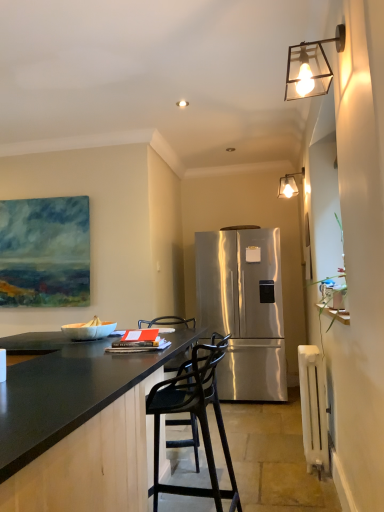
Question: Can you confirm if stainless steel refrigerator at center is taller than white painted radiator at lower right?

Choices:
 (A) yes
 (B) no

Answer: (A)

Question: Can we say stainless steel refrigerator at center lies outside white painted radiator at lower right?

Choices:
 (A) no
 (B) yes

Answer: (B)

Question: Is stainless steel refrigerator at center wider than white painted radiator at lower right?

Choices:
 (A) yes
 (B) no

Answer: (A)

Question: Is white painted radiator at lower right at the back of stainless steel refrigerator at center?

Choices:
 (A) no
 (B) yes

Answer: (A)

Question: From a real-world perspective, is stainless steel refrigerator at center located beneath white painted radiator at lower right?

Choices:
 (A) no
 (B) yes

Answer: (A)

Question: Is stainless steel refrigerator at center surrounding white painted radiator at lower right?

Choices:
 (A) no
 (B) yes

Answer: (A)

Question: From the image's perspective, is metallic glass lampshade at upper right, which ranks as the second lamp in front-to-back order, under black granite countertop at center?

Choices:
 (A) no
 (B) yes

Answer: (A)

Question: Is metallic glass lampshade at upper right, which ranks as the 2th lamp in left-to-right order, surrounding black granite countertop at center?

Choices:
 (A) no
 (B) yes

Answer: (A)

Question: Are metallic glass lampshade at upper right, the 1th lamp from the back, and black granite countertop at center located far from each other?

Choices:
 (A) no
 (B) yes

Answer: (B)

Question: Can we say metallic glass lampshade at upper right, marked as the first lamp in a right-to-left arrangement, lies outside black granite countertop at center?

Choices:
 (A) yes
 (B) no

Answer: (A)

Question: Considering the relative sizes of metallic glass lampshade at upper right, marked as the first lamp in a right-to-left arrangement, and black granite countertop at center in the image provided, is metallic glass lampshade at upper right, marked as the first lamp in a right-to-left arrangement, bigger than black granite countertop at center?

Choices:
 (A) yes
 (B) no

Answer: (B)

Question: Is metallic glass lampshade at upper right, which ranks as the 2th lamp in left-to-right order, smaller than black granite countertop at center?

Choices:
 (A) yes
 (B) no

Answer: (A)

Question: From the image's perspective, is metallic glass lampshade at upper right, which ranks as the 2th lamp in left-to-right order, beneath white painted radiator at lower right?

Choices:
 (A) no
 (B) yes

Answer: (A)